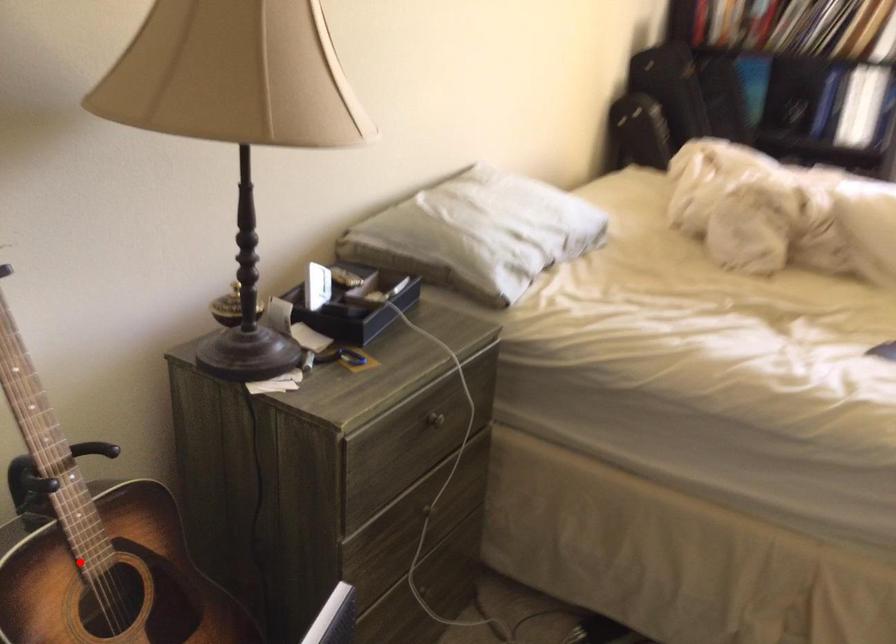
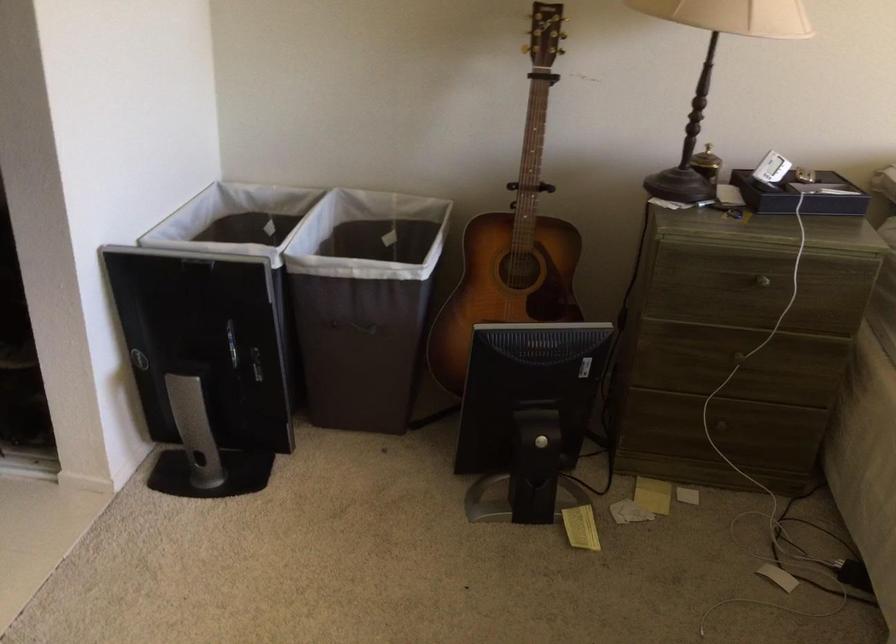
The point at the highlighted location is marked in the first image. Where is the corresponding point in the second image?

(513, 237)